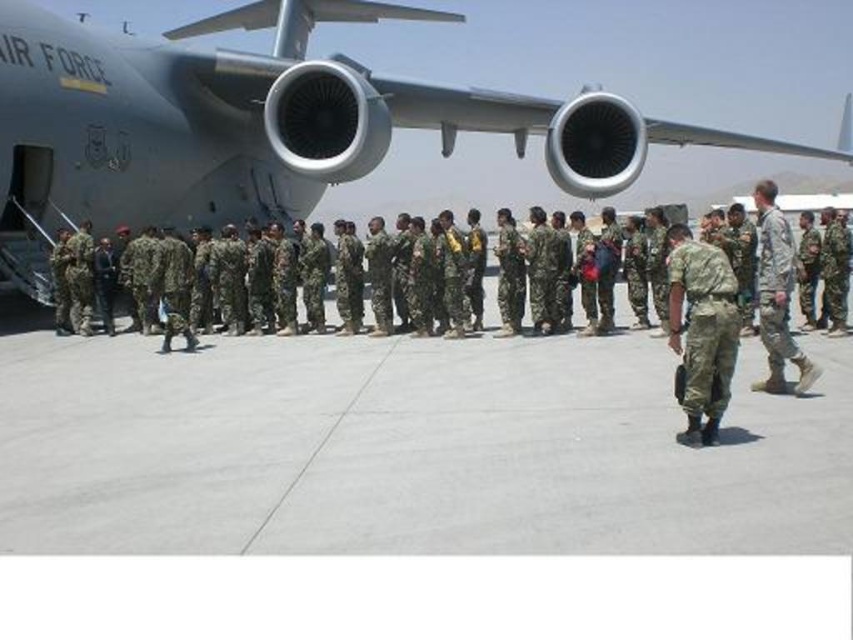
You are a photographer at the airfield. You need to capture a photo that includes both the metallic gray airplane at upper center and the camouflage fabric pants at center. Considering their sizes, which object should be placed closer to the edge of the frame to ensure both fit in the shot?

The camouflage fabric pants at center are narrower than the metallic gray airplane at upper center. To fit both in the frame, position the camouflage fabric pants at center closer to the edge since it takes up less space.